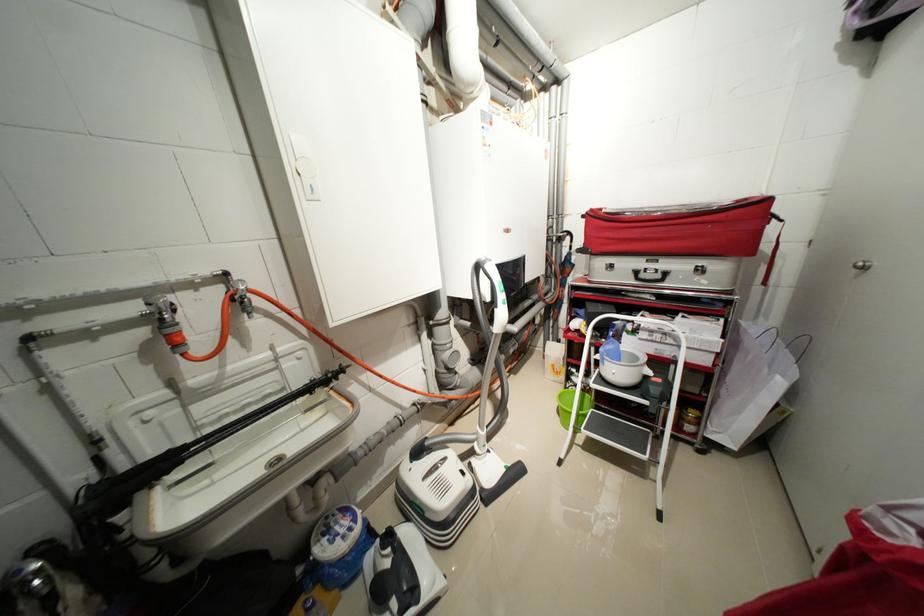
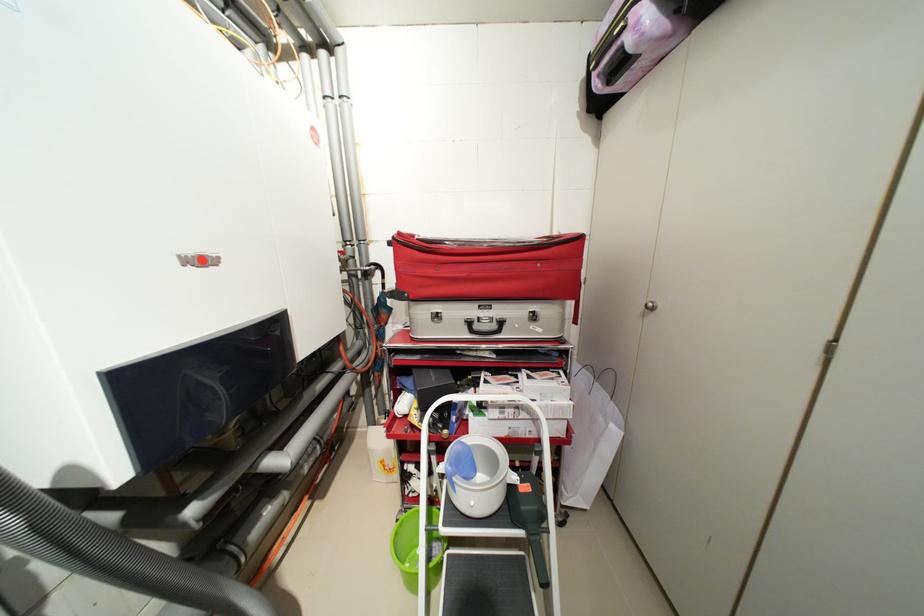
Locate, in the second image, the point that corresponds to (687,347) in the first image.

(541, 421)